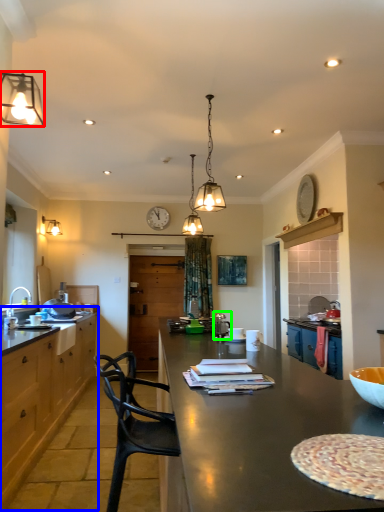
Question: Which is farther away from lamp (highlighted by a red box)? cabinetry (highlighted by a blue box) or appliance (highlighted by a green box)?

Choices:
 (A) cabinetry
 (B) appliance

Answer: (A)